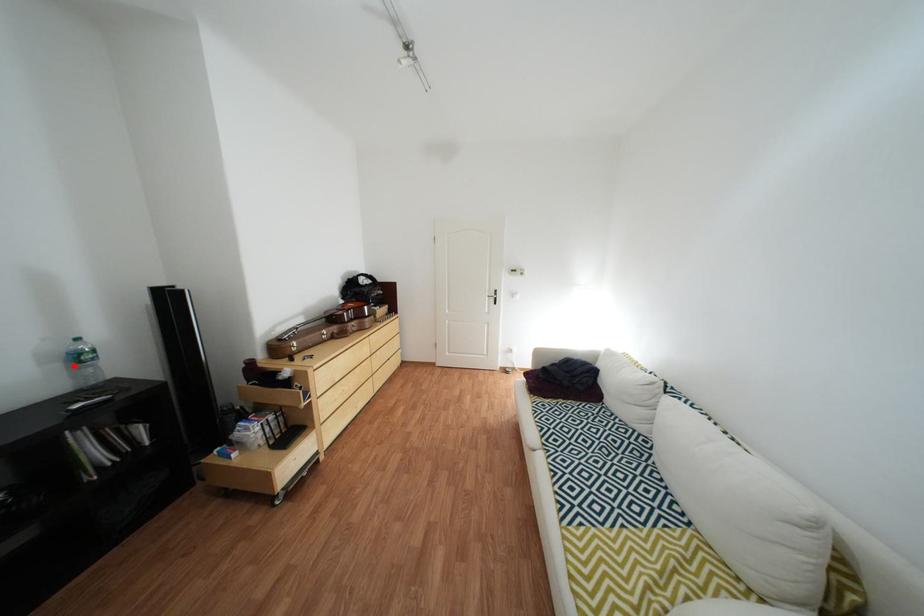
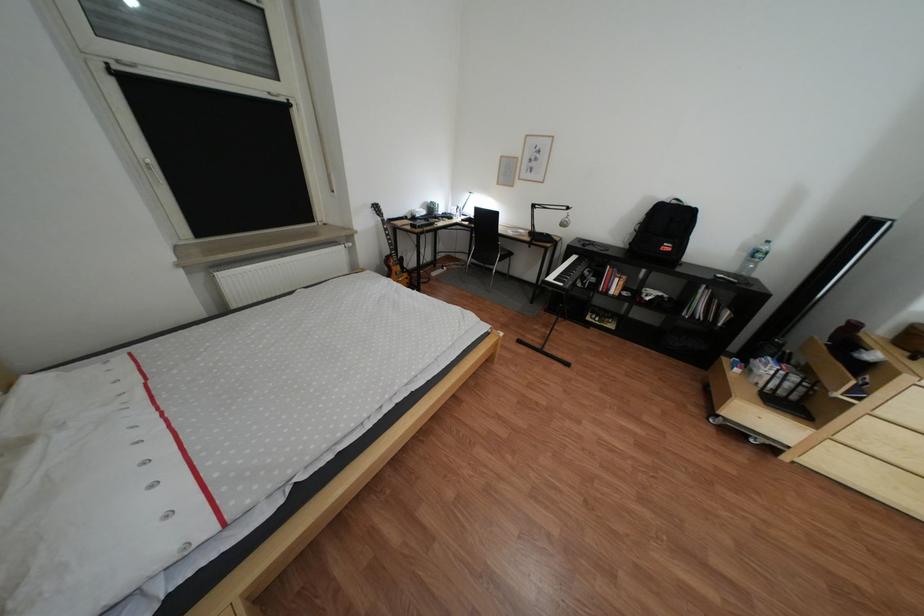
Locate, in the second image, the point that corresponds to the highlighted location in the first image.

(760, 256)